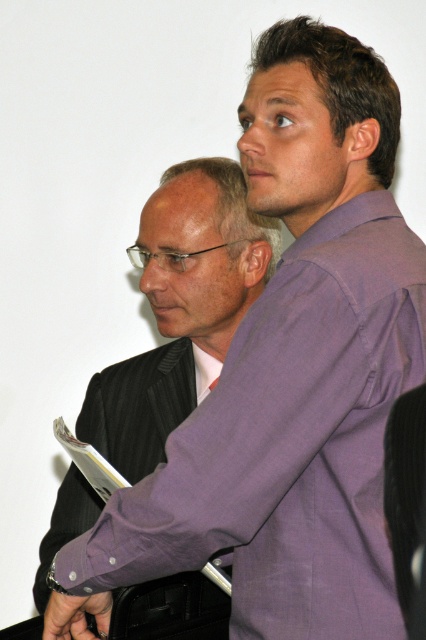
Question: Is purple matte shirt at center bigger than dark gray pinstripe suit at left?

Choices:
 (A) no
 (B) yes

Answer: (B)

Question: Which object appears farthest from the camera in this image?

Choices:
 (A) purple matte shirt at center
 (B) dark gray pinstripe suit at left

Answer: (A)

Question: Is purple matte shirt at center further to the viewer compared to dark gray pinstripe suit at left?

Choices:
 (A) no
 (B) yes

Answer: (B)

Question: Does purple matte shirt at center have a greater width compared to dark gray pinstripe suit at left?

Choices:
 (A) no
 (B) yes

Answer: (B)